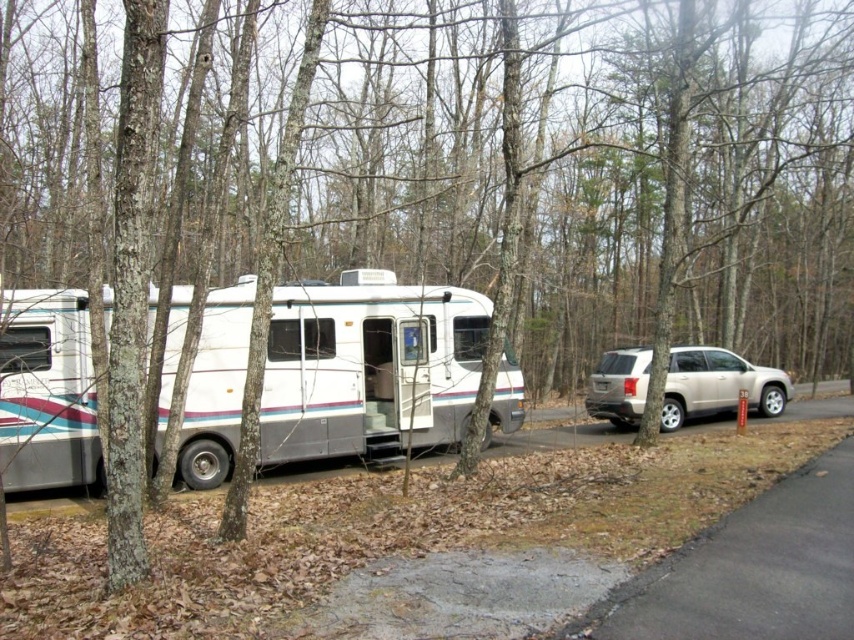
Does white glossy recreational vehicle at center appear under satin gold suv at right?

No, white glossy recreational vehicle at center is not below satin gold suv at right.

Is white glossy recreational vehicle at center positioned in front of satin gold suv at right?

That is True.

Between point (63, 326) and point (722, 390), which one is positioned in front?

Positioned in front is point (63, 326).

Image resolution: width=854 pixels, height=640 pixels. In order to click on white glossy recreational vehicle at center in this screenshot , I will do `click(367, 368)`.